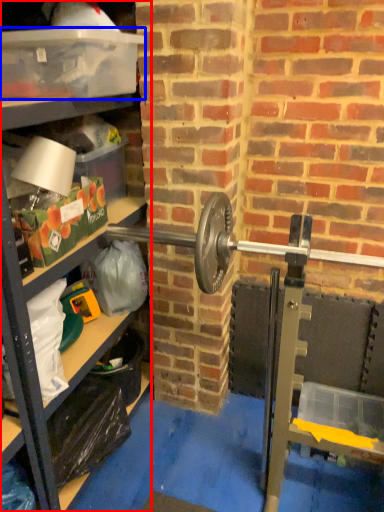
Question: Among these objects, which one is farthest to the camera, shelf (highlighted by a red box) or box (highlighted by a blue box)?

Choices:
 (A) shelf
 (B) box

Answer: (B)